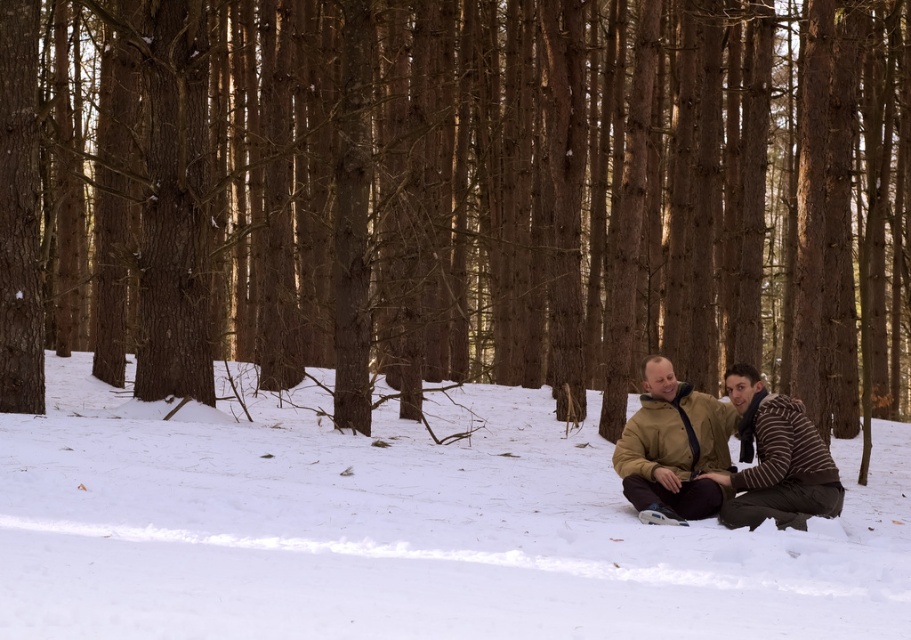
Who is shorter, brown rough tree at center or white fluffy snow at center?

With less height is white fluffy snow at center.

Between point (37, 38) and point (572, 548), which one is positioned in front?

Point (572, 548) is more forward.

In order to click on brown rough tree at center in this screenshot , I will do `click(459, 196)`.

From the picture: Is white fluffy snow at center to the left of tan leather jacket at center from the viewer's perspective?

Indeed, white fluffy snow at center is positioned on the left side of tan leather jacket at center.

Which is above, white fluffy snow at center or tan leather jacket at center?

Positioned higher is tan leather jacket at center.

The height and width of the screenshot is (640, 911). In order to click on white fluffy snow at center in this screenshot , I will do click(404, 531).

At what (x,y) coordinates should I click in order to perform the action: click on white fluffy snow at center. Please return your answer as a coordinate pair (x, y). Image resolution: width=911 pixels, height=640 pixels. Looking at the image, I should click on (404, 531).

Can you confirm if brown rough tree at center is positioned to the right of tan leather jacket at center?

In fact, brown rough tree at center is to the left of tan leather jacket at center.

Which of these two, brown rough tree at center or tan leather jacket at center, stands taller?

Standing taller between the two is brown rough tree at center.

The image size is (911, 640). What are the coordinates of `brown rough tree at center` in the screenshot? It's located at (459, 196).